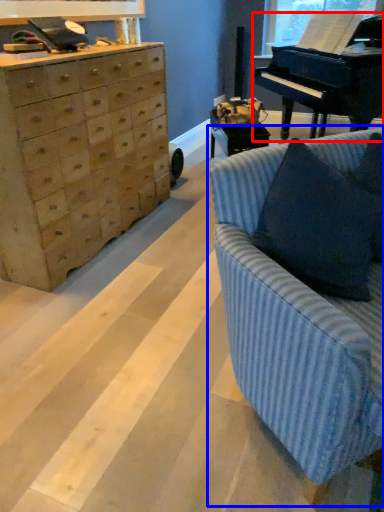
Question: Among these objects, which one is farthest to the camera, piano (highlighted by a red box) or studio couch (highlighted by a blue box)?

Choices:
 (A) piano
 (B) studio couch

Answer: (A)